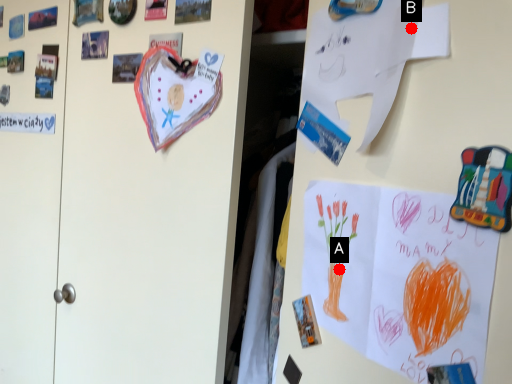
Question: Two points are circled on the image, labeled by A and B beside each circle. Which point appears closest to the camera in this image?

Choices:
 (A) A is closer
 (B) B is closer

Answer: (B)